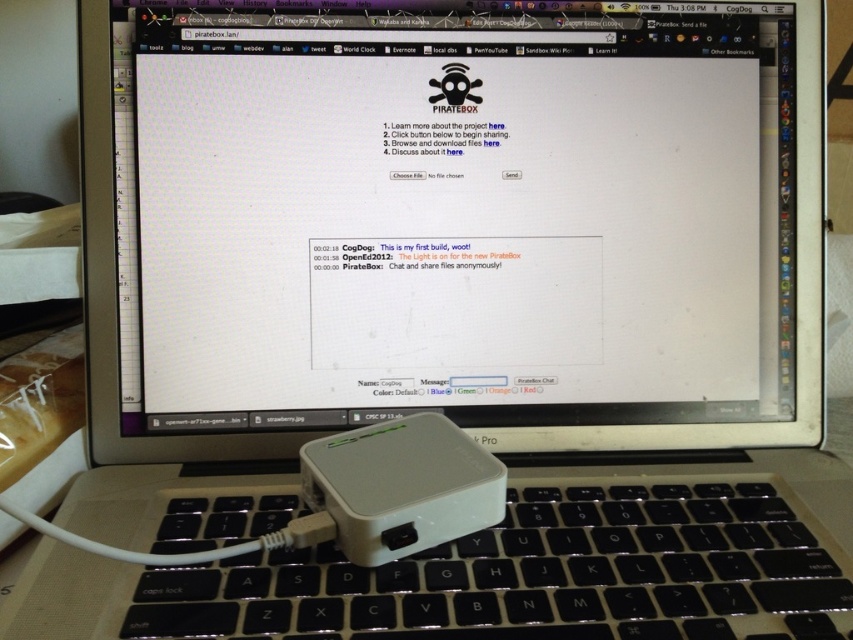
Does black plastic keyboard at lower center have a larger size compared to white plastic ipod at center?

Yes, black plastic keyboard at lower center is bigger than white plastic ipod at center.

Between black plastic keyboard at lower center and white plastic ipod at center, which one appears on the right side from the viewer's perspective?

black plastic keyboard at lower center is more to the right.

You are a GUI agent. You are given a task and a screenshot of the screen. Output one action in this format:
    pyautogui.click(x=<x>, y=<y>)
    Task: Click on the black plastic keyboard at lower center
    The width and height of the screenshot is (853, 640).
    Given the screenshot: What is the action you would take?
    pyautogui.click(x=543, y=573)

Where is `black plastic keyboard at lower center`? The height and width of the screenshot is (640, 853). black plastic keyboard at lower center is located at coordinates (543, 573).